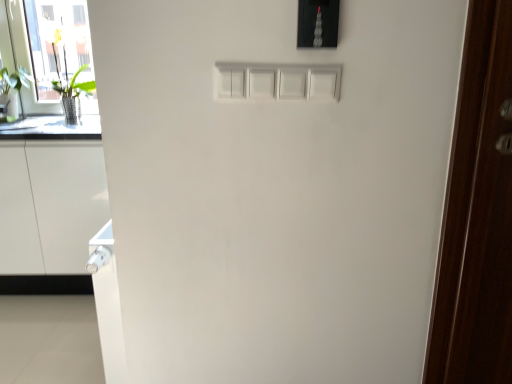
Question: Based on their positions, is dark wood door at right located to the left or right of transparent glass door at left?

Choices:
 (A) left
 (B) right

Answer: (B)

Question: Is dark wood door at right situated inside transparent glass door at left or outside?

Choices:
 (A) inside
 (B) outside

Answer: (B)

Question: Which object is positioned closest to the satin black light switch at upper center?

Choices:
 (A) white glossy cabinet at lower left
 (B) dark wood door at right
 (C) transparent glass door at left
 (D) green leafy plant at left

Answer: (B)

Question: Estimate the real-world distances between objects in this image. Which object is farther from the white glossy cabinet at lower left?

Choices:
 (A) satin black light switch at upper center
 (B) dark wood door at right
 (C) transparent glass door at left
 (D) green leafy plant at left

Answer: (B)